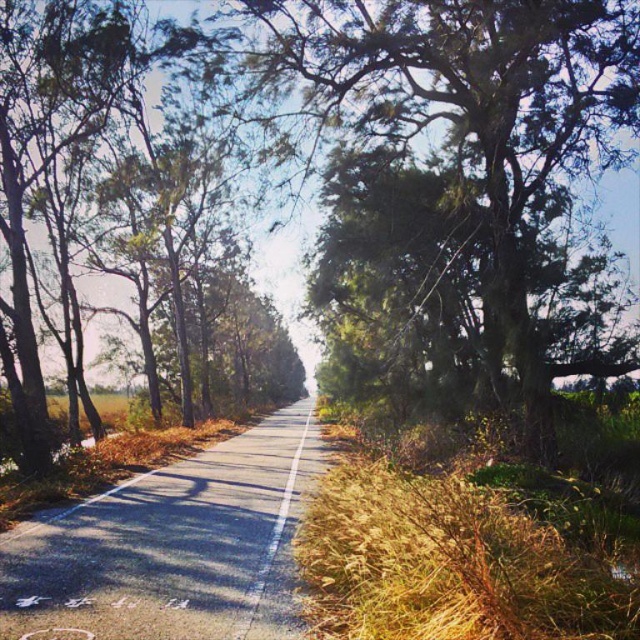
Looking at this image, between green mossy tree at center and dry grass at right, which one appears on the right side from the viewer's perspective?

dry grass at right is more to the right.

From the picture: Is green mossy tree at center wider than dry grass at right?

Indeed, green mossy tree at center has a greater width compared to dry grass at right.

Does point (497, 282) lie behind point (392, 522)?

That is True.

Find the location of `green mossy tree at center`. green mossy tree at center is located at coordinates (442, 179).

Between green mossy tree at center and green leafy tree at left, which one is positioned higher?

green leafy tree at left

Does green mossy tree at center appear on the left side of green leafy tree at left?

Incorrect, green mossy tree at center is not on the left side of green leafy tree at left.

Is point (388, 252) more distant than point (56, 140)?

No, (388, 252) is closer to viewer.

Where is `green mossy tree at center`? The height and width of the screenshot is (640, 640). green mossy tree at center is located at coordinates (442, 179).

Is point (392, 472) in front of point (1, 19)?

Yes, point (392, 472) is closer to viewer.

Does dry grass at right have a lesser height compared to green leafy tree at left?

Correct, dry grass at right is not as tall as green leafy tree at left.

I want to click on dry grass at right, so click(449, 563).